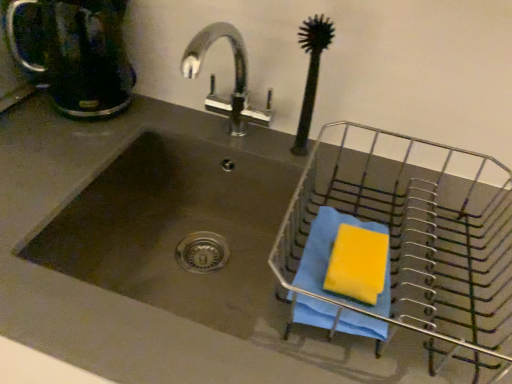
Question: Is metallic wire basket at right aimed at stainless steel sink at center?

Choices:
 (A) yes
 (B) no

Answer: (B)

Question: Is metallic wire basket at right closer to the viewer compared to stainless steel sink at center?

Choices:
 (A) no
 (B) yes

Answer: (B)

Question: Considering the relative sizes of metallic wire basket at right and stainless steel sink at center in the image provided, is metallic wire basket at right smaller than stainless steel sink at center?

Choices:
 (A) yes
 (B) no

Answer: (A)

Question: Can you confirm if metallic wire basket at right is wider than stainless steel sink at center?

Choices:
 (A) no
 (B) yes

Answer: (A)

Question: From the image's perspective, would you say metallic wire basket at right is shown under stainless steel sink at center?

Choices:
 (A) yes
 (B) no

Answer: (B)

Question: Does metallic wire basket at right appear on the right side of stainless steel sink at center?

Choices:
 (A) no
 (B) yes

Answer: (B)

Question: Considering the relative sizes of matte black coffeepot at upper left and stainless steel sink at center in the image provided, is matte black coffeepot at upper left smaller than stainless steel sink at center?

Choices:
 (A) yes
 (B) no

Answer: (A)

Question: Considering the relative sizes of matte black coffeepot at upper left and stainless steel sink at center in the image provided, is matte black coffeepot at upper left thinner than stainless steel sink at center?

Choices:
 (A) no
 (B) yes

Answer: (B)

Question: Can you confirm if matte black coffeepot at upper left is taller than stainless steel sink at center?

Choices:
 (A) no
 (B) yes

Answer: (B)

Question: Does matte black coffeepot at upper left have a larger size compared to stainless steel sink at center?

Choices:
 (A) yes
 (B) no

Answer: (B)

Question: Is matte black coffeepot at upper left wider than stainless steel sink at center?

Choices:
 (A) yes
 (B) no

Answer: (B)

Question: From a real-world perspective, is matte black coffeepot at upper left under stainless steel sink at center?

Choices:
 (A) no
 (B) yes

Answer: (A)

Question: Can you confirm if matte black coffeepot at upper left is taller than metallic wire basket at right?

Choices:
 (A) no
 (B) yes

Answer: (B)